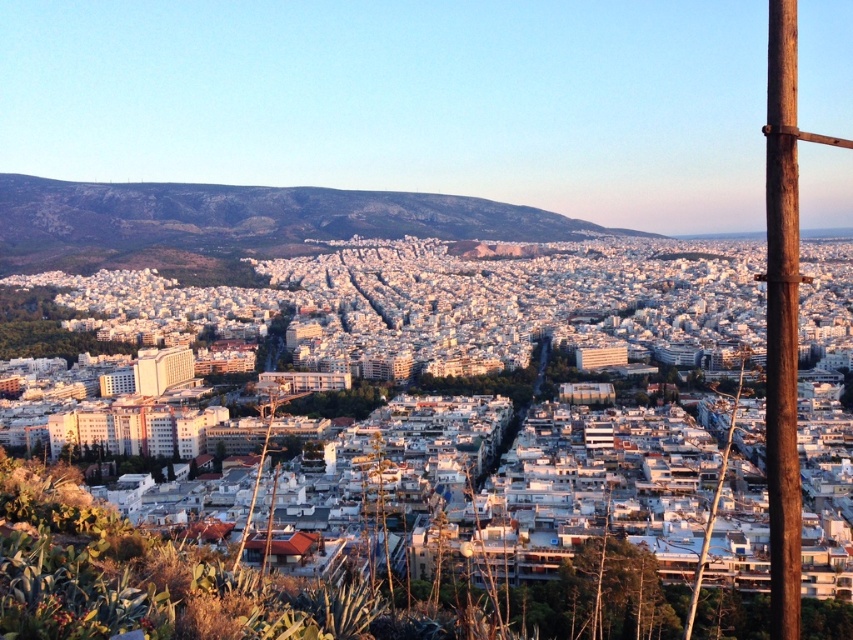
You are a drone operator trying to navigate a delivery drone through the urban area shown in the image. The drone must avoid obstacles and reach a delivery point located at the coordinates provided. Based on the scene description, can you determine what object is located at the coordinates point (782, 321)?

The point (782, 321) corresponds to the brown wooden pole at right, so the delivery point is at the brown wooden pole at right.

You are a city planner analyzing the urban layout. You notice two brown wooden poles on the right side of the image. Which one is located more to the right between the brown wooden pole at right and the brown wooden telegraph pole at right?

The brown wooden pole at right is positioned more to the right because it is on the right side of the brown wooden telegraph pole at right.